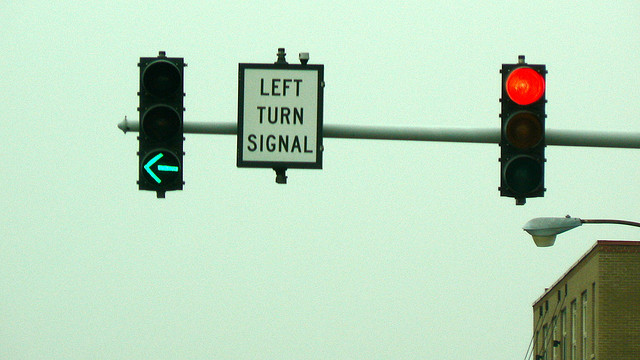
Where is `unlit red light`? unlit red light is located at coordinates (160, 75).